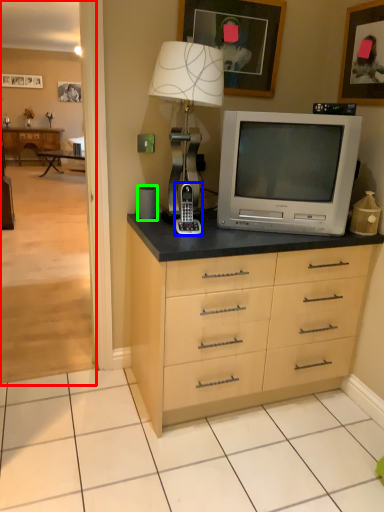
Question: Estimate the real-world distances between objects in this image. Which object is farther from corridor (highlighted by a red box), appliance (highlighted by a blue box) or speaker (highlighted by a green box)?

Choices:
 (A) appliance
 (B) speaker

Answer: (B)